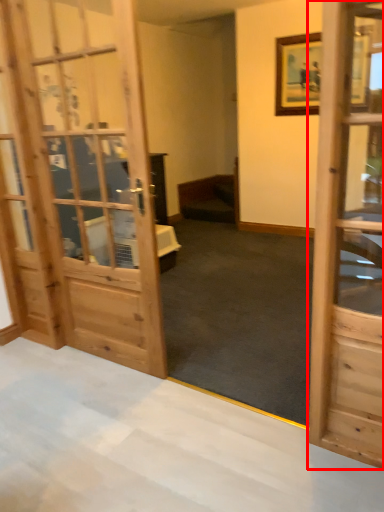
Question: From the image, what is the correct spatial relationship of door (annotated by the red box) in relation to furniture?

Choices:
 (A) left
 (B) right

Answer: (B)